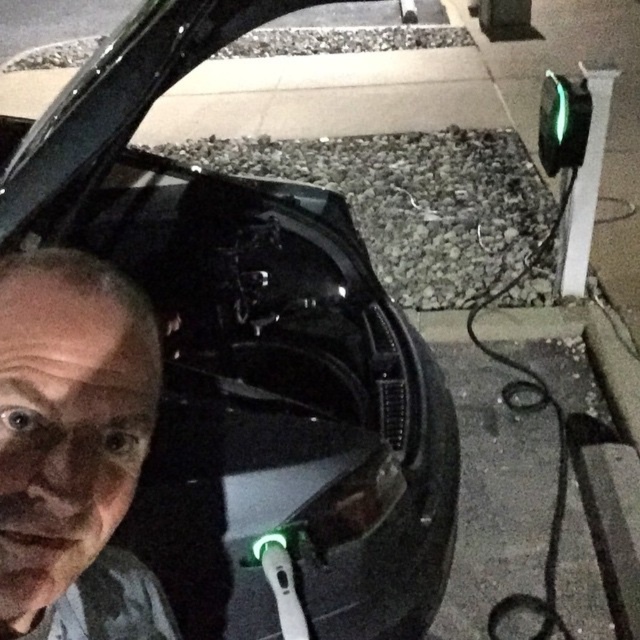
The height and width of the screenshot is (640, 640). Identify the location of black glossy car at center. (250, 356).

Does black glossy car at center come behind gray matte face at center?

Yes, black glossy car at center is behind gray matte face at center.

You are a GUI agent. You are given a task and a screenshot of the screen. Output one action in this format:
    pyautogui.click(x=<x>, y=<y>)
    Task: Click on the black glossy car at center
    
    Given the screenshot: What is the action you would take?
    pyautogui.click(x=250, y=356)

You are a GUI agent. You are given a task and a screenshot of the screen. Output one action in this format:
    pyautogui.click(x=<x>, y=<y>)
    Task: Click on the black glossy car at center
    Image resolution: width=640 pixels, height=640 pixels.
    Given the screenshot: What is the action you would take?
    pyautogui.click(x=250, y=356)